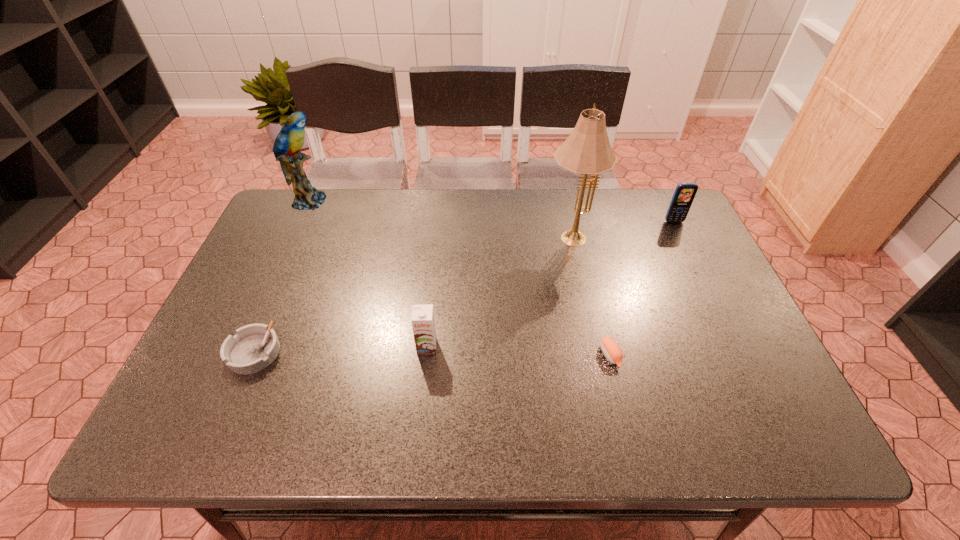
The image size is (960, 540). I want to click on the tallest object, so click(587, 150).

In order to click on parrot in this screenshot , I will do `click(289, 141)`.

Where is `the farthest object`? the farthest object is located at coordinates (289, 141).

Find the location of a particular element. The height and width of the screenshot is (540, 960). the rightmost object is located at coordinates (684, 194).

Locate an element on the screen. chocolate milk is located at coordinates coord(423,322).

Where is `ashtray`? ashtray is located at coordinates (255, 346).

You are a GUI agent. You are given a task and a screenshot of the screen. Output one action in this format:
    pyautogui.click(x=<x>, y=<y>)
    Task: Click on the sushi
    
    Given the screenshot: What is the action you would take?
    pyautogui.click(x=611, y=350)

Where is `vacant area located 0.050m on the back of the lampshade`? The height and width of the screenshot is (540, 960). vacant area located 0.050m on the back of the lampshade is located at coordinates (564, 209).

You are a GUI agent. You are given a task and a screenshot of the screen. Output one action in this format:
    pyautogui.click(x=<x>, y=<y>)
    Task: Click on the free space located on the face of the fifth shortest object
    This screenshot has height=540, width=960.
    Given the screenshot: What is the action you would take?
    pyautogui.click(x=356, y=201)

Image resolution: width=960 pixels, height=540 pixels. I want to click on vacant space located on the screen of the rightmost object, so click(x=704, y=282).